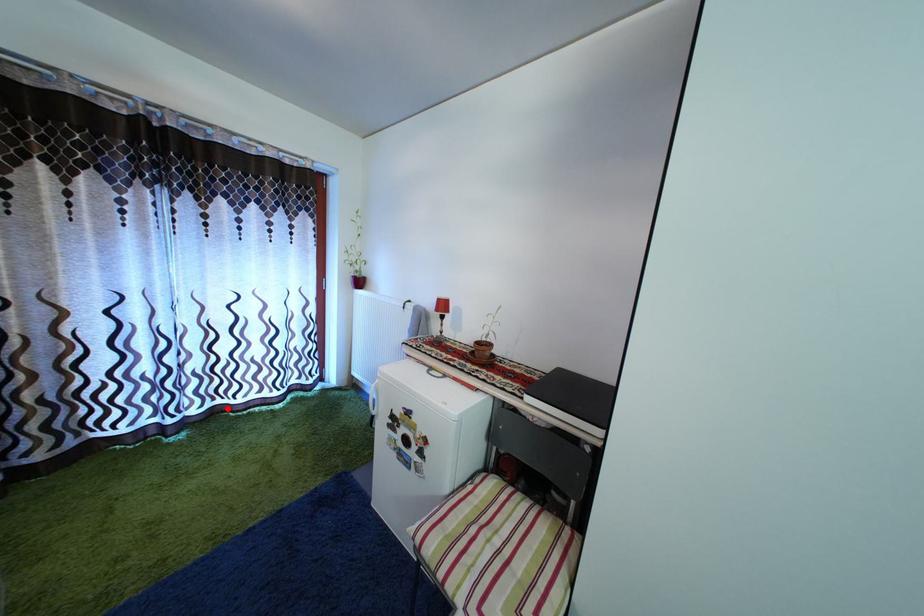
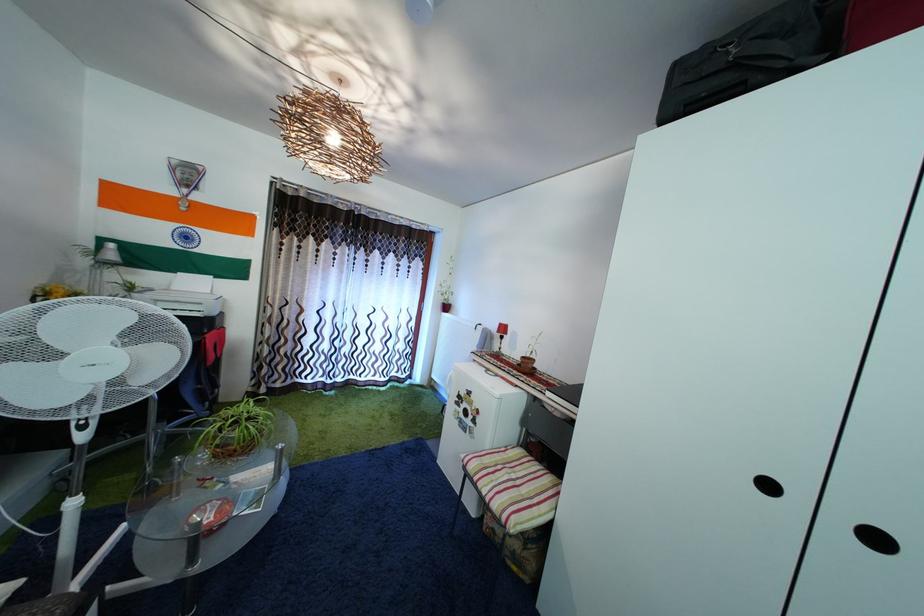
Question: I am providing you with two images of the same scene from different viewpoints. A red point is shown in image1. For the corresponding object point in image2, is it positioned nearer or farther from the camera?

Choices:
 (A) Nearer
 (B) Farther

Answer: (B)